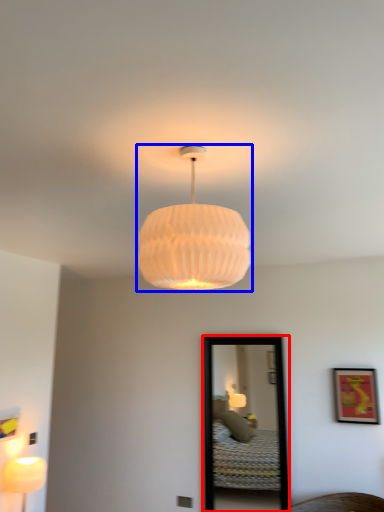
Question: Which object appears farthest to the camera in this image, mirror (highlighted by a red box) or lamp (highlighted by a blue box)?

Choices:
 (A) mirror
 (B) lamp

Answer: (A)